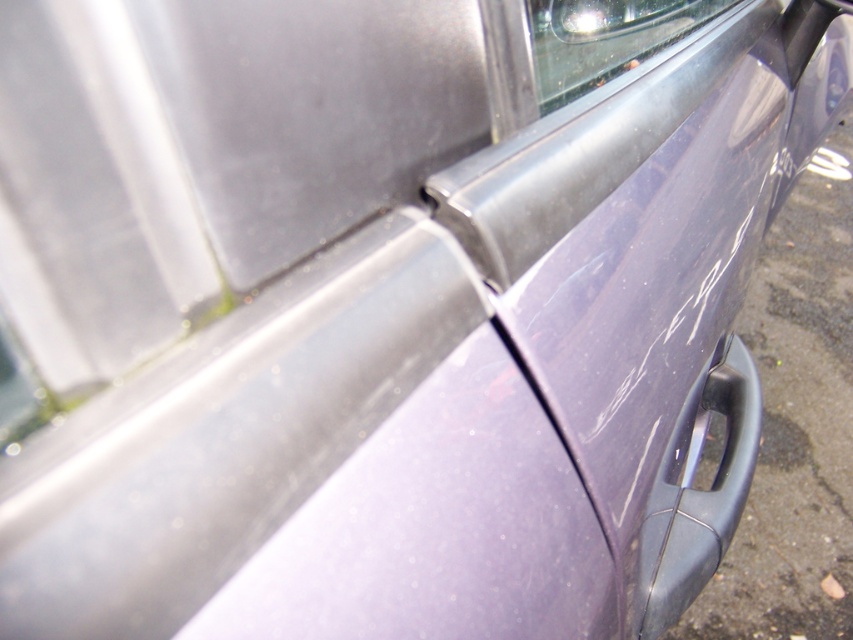
Question: Where is satin black door handle at lower right located in relation to clear glass window at upper center in the image?

Choices:
 (A) right
 (B) left

Answer: (A)

Question: Does satin black door handle at lower right have a greater width compared to clear glass window at upper center?

Choices:
 (A) no
 (B) yes

Answer: (A)

Question: In this image, where is satin black door handle at lower right located relative to clear glass window at upper center?

Choices:
 (A) below
 (B) above

Answer: (A)

Question: Which object appears farthest from the camera in this image?

Choices:
 (A) clear glass window at upper center
 (B) satin black door handle at lower right

Answer: (B)